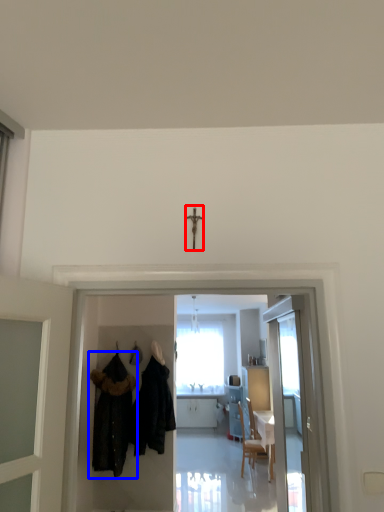
Question: Which point is further to the camera, crucifix (highlighted by a red box) or fancy dress (highlighted by a blue box)?

Choices:
 (A) crucifix
 (B) fancy dress

Answer: (B)